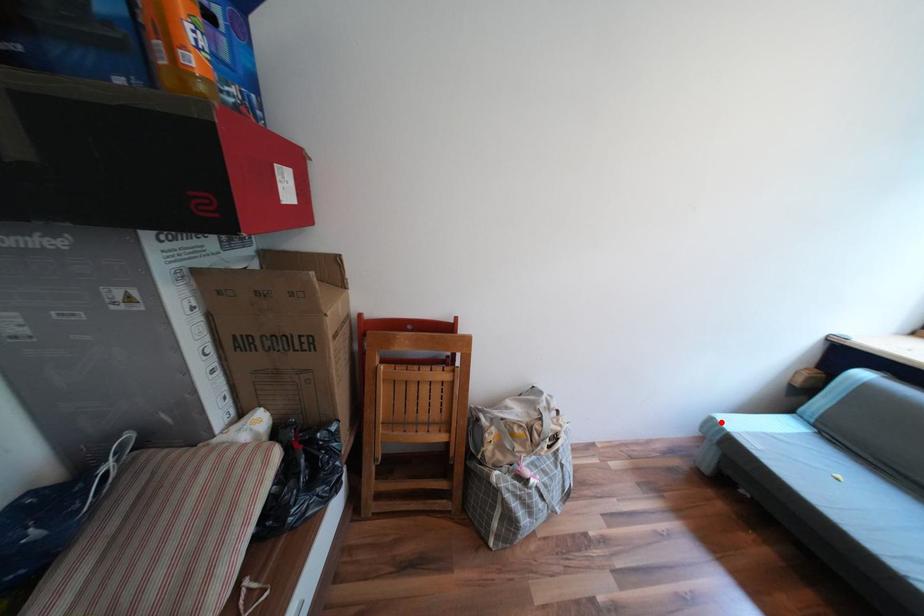
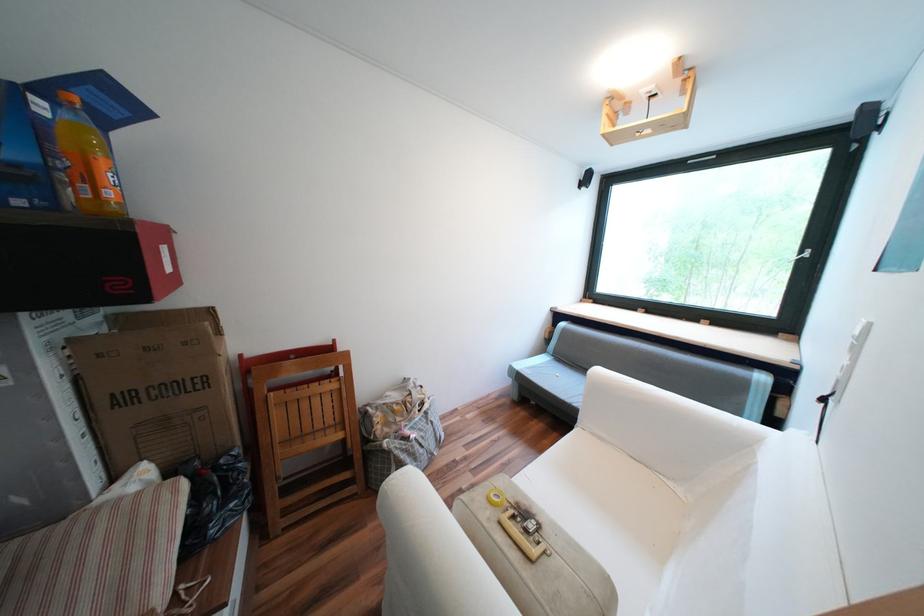
Question: I am providing you with two images of the same scene from different viewpoints. Given a red point in image1, look at the same physical point in image2. Is it:

Choices:
 (A) Closer to the viewpoint
 (B) Farther from the viewpoint

Answer: (B)